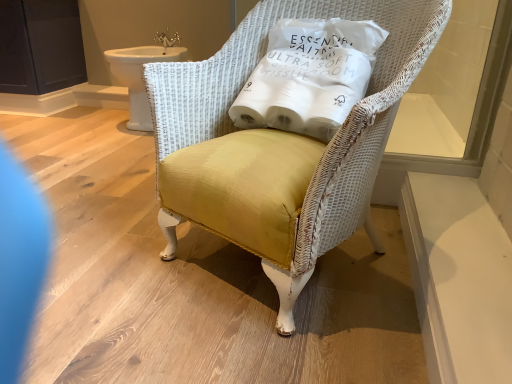
What do you see at coordinates (309, 76) in the screenshot? The height and width of the screenshot is (384, 512). I see `white fabric pillow at upper center` at bounding box center [309, 76].

The image size is (512, 384). What do you see at coordinates (334, 136) in the screenshot?
I see `white wicker chair at center` at bounding box center [334, 136].

Identify the location of white wicker chair at center. (334, 136).

Describe the element at coordinates (456, 83) in the screenshot. I see `transparent glass window at upper right` at that location.

Describe the element at coordinates (40, 46) in the screenshot. I see `dark matte cabinet at upper left` at that location.

Where is `white fabric pillow at upper center`? This screenshot has width=512, height=384. white fabric pillow at upper center is located at coordinates (309, 76).

Does point (136, 60) come farther from viewer compared to point (42, 37)?

No, it is in front of (42, 37).

Can you confirm if white ceramic sink at upper left is wider than dark matte cabinet at upper left?

Yes.

Which of these two, white ceramic sink at upper left or dark matte cabinet at upper left, stands taller?

With more height is dark matte cabinet at upper left.

Between white ceramic sink at upper left and dark matte cabinet at upper left, which one appears on the left side from the viewer's perspective?

Positioned to the left is dark matte cabinet at upper left.

Is white fabric pillow at upper center a part of transparent glass window at upper right?

No, white fabric pillow at upper center is not a part of transparent glass window at upper right.

Who is bigger, transparent glass window at upper right or white fabric pillow at upper center?

With larger size is white fabric pillow at upper center.

Which of these two, transparent glass window at upper right or white fabric pillow at upper center, stands taller?

Standing taller between the two is transparent glass window at upper right.

Considering the sizes of objects transparent glass window at upper right and white fabric pillow at upper center in the image provided, who is wider, transparent glass window at upper right or white fabric pillow at upper center?

white fabric pillow at upper center.

Could you tell me if white wicker chair at center is turned towards white ceramic sink at upper left?

No.

In the scene shown: Considering the relative positions of white wicker chair at center and white ceramic sink at upper left in the image provided, is white wicker chair at center to the left of white ceramic sink at upper left from the viewer's perspective?

No.

Is white wicker chair at center positioned in front of white ceramic sink at upper left?

Yes.

Identify the location of pillow that appears above the white ceramic sink at upper left (from a real-world perspective). This screenshot has height=384, width=512. (309, 76).

Is white fabric pillow at upper center oriented towards white ceramic sink at upper left?

No, white fabric pillow at upper center is not turned towards white ceramic sink at upper left.

From the image's perspective, which is below, white fabric pillow at upper center or white ceramic sink at upper left?

white fabric pillow at upper center is shown below in the image.

From a real-world perspective, is white fabric pillow at upper center physically below white ceramic sink at upper left?

No.

Can you tell me how much dark matte cabinet at upper left and transparent glass window at upper right differ in facing direction?

They differ by 89.4 degrees in their facing directions.

From the image's perspective, is dark matte cabinet at upper left below transparent glass window at upper right?

No.

Looking at their sizes, would you say dark matte cabinet at upper left is wider or thinner than transparent glass window at upper right?

Clearly, dark matte cabinet at upper left has more width compared to transparent glass window at upper right.

Which is behind, point (13, 44) or point (504, 22)?

The point (13, 44) is more distant.

Considering the points (112, 49) and (316, 32), which point is in front, point (112, 49) or point (316, 32)?

The point (316, 32) is closer to the camera.

Could you tell me if white ceramic sink at upper left is turned towards white fabric pillow at upper center?

No.

Find the location of a particular element. pillow above the white ceramic sink at upper left (from a real-world perspective) is located at coordinates (309, 76).

What's the angular difference between white ceramic sink at upper left and white fabric pillow at upper center's facing directions?

The angular difference between white ceramic sink at upper left and white fabric pillow at upper center is 17.4 degrees.

At what (x,y) coordinates should I click in order to perform the action: click on sink that appears below the transparent glass window at upper right (from a real-world perspective). Please return your answer as a coordinate pair (x, y). Looking at the image, I should click on (142, 74).

Is point (133, 103) closer or farther from the camera than point (441, 152)?

Point (133, 103) appears to be farther away from the viewer than point (441, 152).

Considering the sizes of white ceramic sink at upper left and transparent glass window at upper right in the image, is white ceramic sink at upper left taller or shorter than transparent glass window at upper right?

Considering their sizes, white ceramic sink at upper left has less height than transparent glass window at upper right.

What's the angular difference between white ceramic sink at upper left and transparent glass window at upper right's facing directions?

There is a 91.2-degree angle between the facing directions of white ceramic sink at upper left and transparent glass window at upper right.

Locate an element on the screen. sink that appears below the dark matte cabinet at upper left (from the image's perspective) is located at coordinates (142, 74).

This screenshot has width=512, height=384. Identify the location of window to the right of white fabric pillow at upper center. (456, 83).

From the image, which object appears to be farther from white ceramic sink at upper left, transparent glass window at upper right or dark matte cabinet at upper left?

transparent glass window at upper right is further to white ceramic sink at upper left.

From the image, which object appears to be farther from white fabric pillow at upper center, dark matte cabinet at upper left or white ceramic sink at upper left?

Based on the image, dark matte cabinet at upper left appears to be further to white fabric pillow at upper center.

Looking at the image, which one is located closer to white wicker chair at center, white fabric pillow at upper center or transparent glass window at upper right?

white fabric pillow at upper center is positioned closer to the anchor white wicker chair at center.

From the image, which object appears to be nearer to white wicker chair at center, transparent glass window at upper right or white ceramic sink at upper left?

Based on the image, transparent glass window at upper right appears to be nearer to white wicker chair at center.

Estimate the real-world distances between objects in this image. Which object is further from white ceramic sink at upper left, white fabric pillow at upper center or transparent glass window at upper right?

The object further to white ceramic sink at upper left is transparent glass window at upper right.

Based on their spatial positions, is transparent glass window at upper right or white ceramic sink at upper left further from white fabric pillow at upper center?

white ceramic sink at upper left lies further to white fabric pillow at upper center than the other object.

Looking at the image, which one is located closer to white ceramic sink at upper left, dark matte cabinet at upper left or white fabric pillow at upper center?

dark matte cabinet at upper left is closer to white ceramic sink at upper left.

Considering their positions, is white fabric pillow at upper center positioned further to transparent glass window at upper right than dark matte cabinet at upper left?

dark matte cabinet at upper left lies further to transparent glass window at upper right than the other object.

You are a GUI agent. You are given a task and a screenshot of the screen. Output one action in this format:
    pyautogui.click(x=<x>, y=<y>)
    Task: Click on the pillow between dark matte cabinet at upper left and transparent glass window at upper right in the horizontal direction
    
    Given the screenshot: What is the action you would take?
    pyautogui.click(x=309, y=76)

You are a GUI agent. You are given a task and a screenshot of the screen. Output one action in this format:
    pyautogui.click(x=<x>, y=<y>)
    Task: Click on the chair located between dark matte cabinet at upper left and transparent glass window at upper right in the left-right direction
    
    Given the screenshot: What is the action you would take?
    pyautogui.click(x=334, y=136)

Where is `sink situated between dark matte cabinet at upper left and white fabric pillow at upper center from left to right`? The height and width of the screenshot is (384, 512). sink situated between dark matte cabinet at upper left and white fabric pillow at upper center from left to right is located at coordinates (142, 74).

Where is `sink located between white wicker chair at center and dark matte cabinet at upper left in the depth direction`? sink located between white wicker chair at center and dark matte cabinet at upper left in the depth direction is located at coordinates coord(142,74).